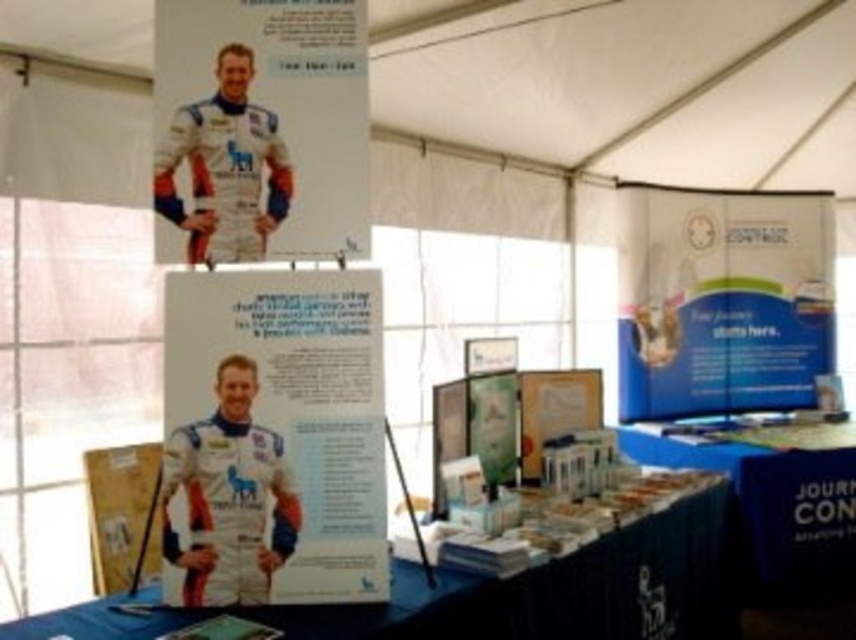
Does point (572, 596) come farther from viewer compared to point (195, 186)?

That is True.

You are a GUI agent. You are given a task and a screenshot of the screen. Output one action in this format:
    pyautogui.click(x=<x>, y=<y>)
    Task: Click on the blue fabric table at center
    This screenshot has height=640, width=856.
    Given the screenshot: What is the action you would take?
    pyautogui.click(x=497, y=595)

Measure the distance between white fabric poster at center and camera.

white fabric poster at center is 6.84 feet from camera.

Is white fabric poster at center closer to camera compared to white fabric astronaut at upper center?

That is True.

Measure the distance between white fabric poster at center and camera.

white fabric poster at center is 6.84 feet away from camera.

Find the location of `white fabric poster at center`. white fabric poster at center is located at coordinates (272, 436).

Which is behind, point (849, 508) or point (276, 211)?

The point (849, 508) is behind.

Is point (817, 452) positioned after point (241, 68)?

That is True.

The image size is (856, 640). Find the location of `blue fabric table at lower right`. blue fabric table at lower right is located at coordinates (773, 506).